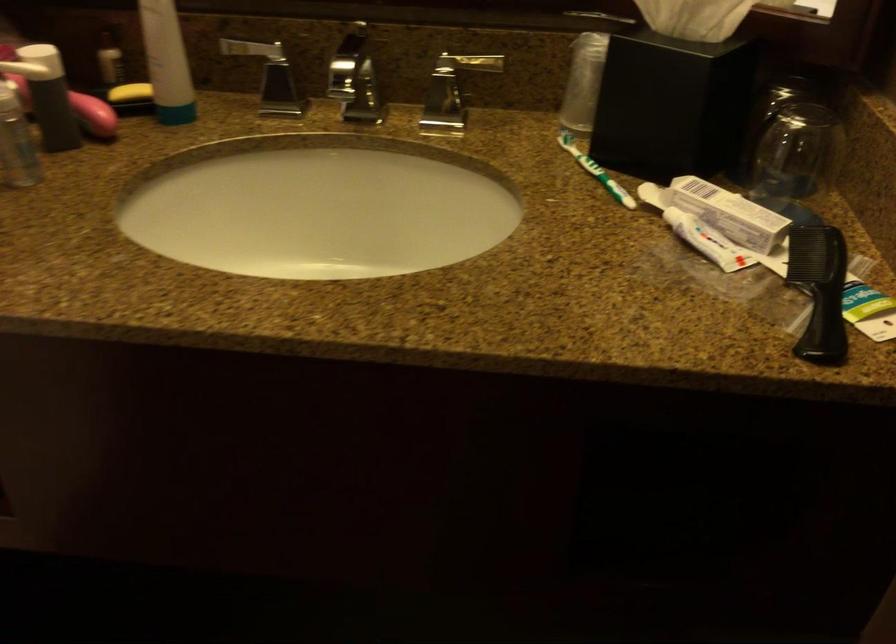
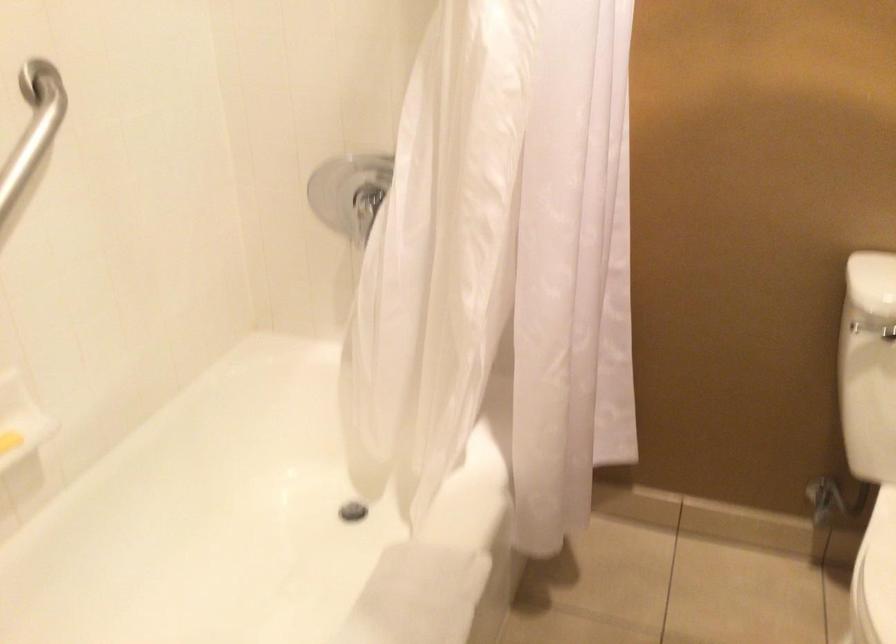
How did the camera likely rotate?

The camera's rotation is toward left-down.